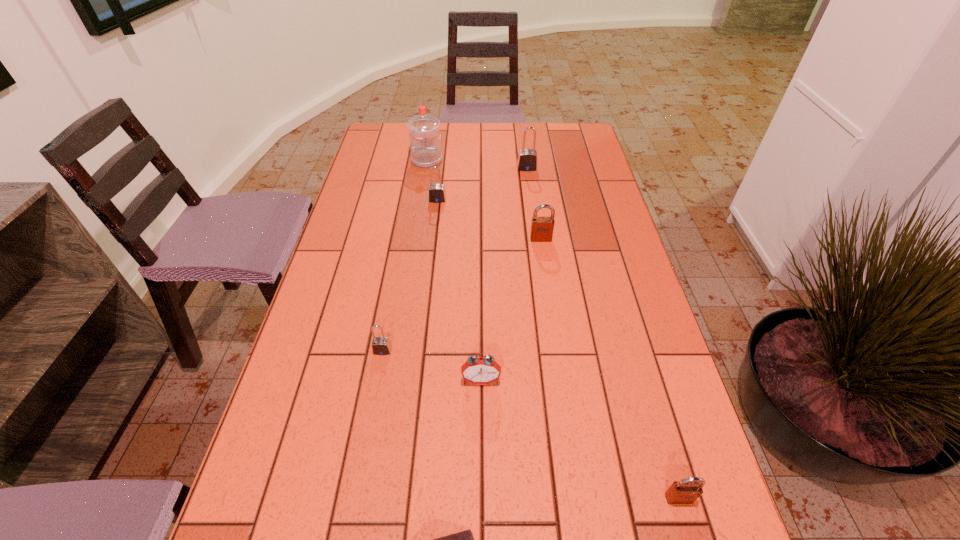
Locate an element on the screen. The image size is (960, 540). water bottle is located at coordinates (x=424, y=136).

Find the location of `white water bottle`. white water bottle is located at coordinates (424, 136).

Locate an element on the screen. the seventh shortest object is located at coordinates (527, 158).

This screenshot has width=960, height=540. I want to click on the farthest gray padlock, so [527, 158].

You are a GUI agent. You are given a task and a screenshot of the screen. Output one action in this format:
    pyautogui.click(x=<x>, y=<y>)
    Task: Click on the second smallest gray padlock
    
    Given the screenshot: What is the action you would take?
    pyautogui.click(x=436, y=193)

I want to click on the fourth nearest padlock, so click(436, 193).

At what (x,y) coordinates should I click in order to perform the action: click on the farther brown padlock. Please return your answer as a coordinate pair (x, y). Looking at the image, I should click on (542, 228).

Find the location of `the left brown padlock`. the left brown padlock is located at coordinates (542, 228).

Find the location of a particular element. The height and width of the screenshot is (540, 960). alarm clock is located at coordinates (479, 371).

This screenshot has width=960, height=540. In order to click on the smallest gray padlock in this screenshot , I will do `click(380, 345)`.